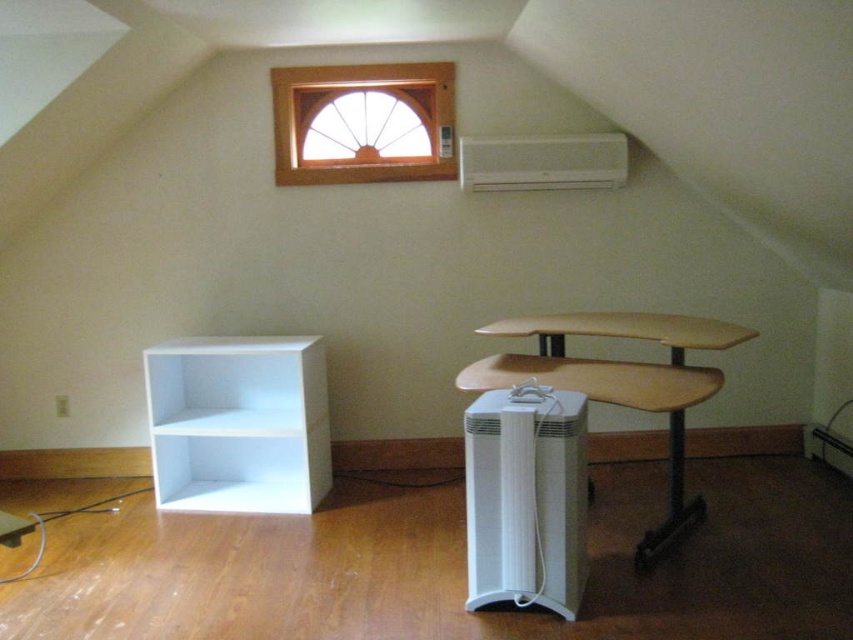
You are standing in the room and want to place a large painting between the white matte bookshelf at lower left and the white plastic air conditioner at upper center. Can you hang the painting in a position that is equidistant from both objects?

The white matte bookshelf at lower left is closer to the viewer than the white plastic air conditioner at upper center. Therefore, it is not possible to hang the painting equidistant from both objects since one is nearer and the other is farther away.

You are moving a large painting that is 1.2 meters wide. You want to hang it on the wall where the wooden window at upper center and wooden desk at center are located. Which object can the painting be placed next to without overlapping?

The wooden desk at center has a larger size compared to the wooden window at upper center, so the painting can be placed next to the wooden desk at center without overlapping.

You are standing in the center of the room and want to place a new painting on the wall. The painting is 1.2 meters wide. The wall space between the white matte bookshelf at lower left and the window is 2.5 meters. Is there enough space to hang the painting there?

The wall space between the white matte bookshelf at lower left and the window is 2.5 meters, which is wider than the painting that is 1.2 meters wide. Therefore, there is enough space to hang the painting there.